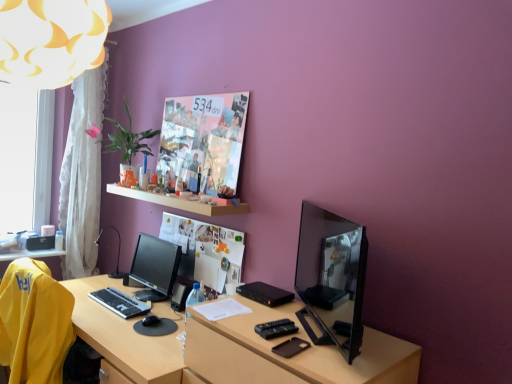
The height and width of the screenshot is (384, 512). I want to click on vacant space in shiny black monitor at right, the 2th computer monitor positioned from the left (from a real-world perspective), so click(328, 340).